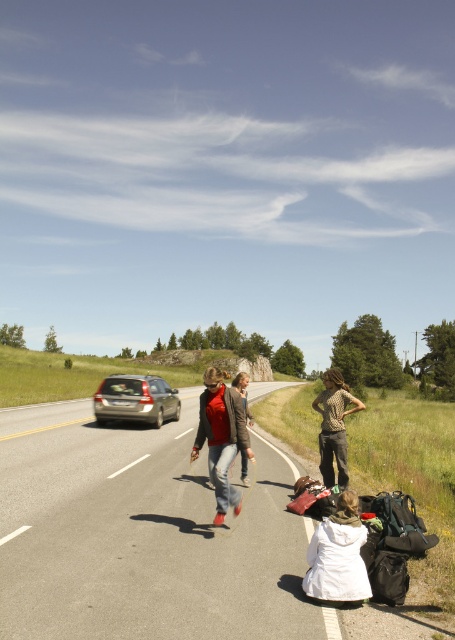
Does asphalt road at center appear under satin silver car at center?

Indeed, asphalt road at center is positioned under satin silver car at center.

Does asphalt road at center appear over satin silver car at center?

Incorrect, asphalt road at center is not positioned above satin silver car at center.

Who is more forward, (233,548) or (156,387)?

Point (233,548) is in front.

What are the coordinates of `asphalt road at center` in the screenshot? It's located at (143, 536).

The image size is (455, 640). What do you see at coordinates (143, 536) in the screenshot? I see `asphalt road at center` at bounding box center [143, 536].

Who is shorter, asphalt road at center or denim jacket at center?

With less height is asphalt road at center.

Where is `asphalt road at center`? The height and width of the screenshot is (640, 455). asphalt road at center is located at coordinates (143, 536).

Find the location of a particular element. This screenshot has height=640, width=455. asphalt road at center is located at coordinates (143, 536).

Who is shorter, asphalt road at center or matte red shoes at center?

Standing shorter between the two is asphalt road at center.

The width and height of the screenshot is (455, 640). Find the location of `asphalt road at center`. asphalt road at center is located at coordinates (143, 536).

You are a GUI agent. You are given a task and a screenshot of the screen. Output one action in this format:
    pyautogui.click(x=<x>, y=<y>)
    Task: Click on the asphalt road at center
    The height and width of the screenshot is (640, 455).
    Given the screenshot: What is the action you would take?
    pyautogui.click(x=143, y=536)